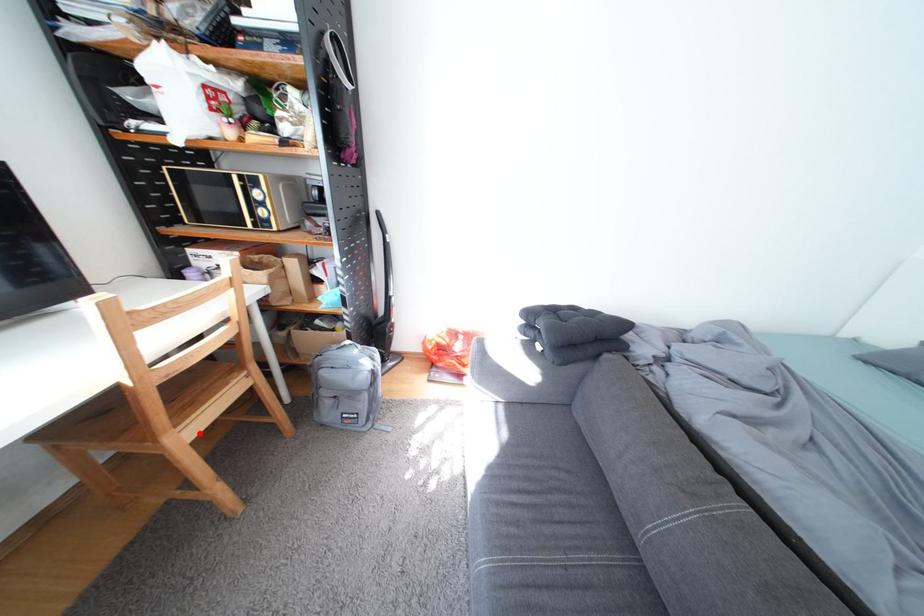
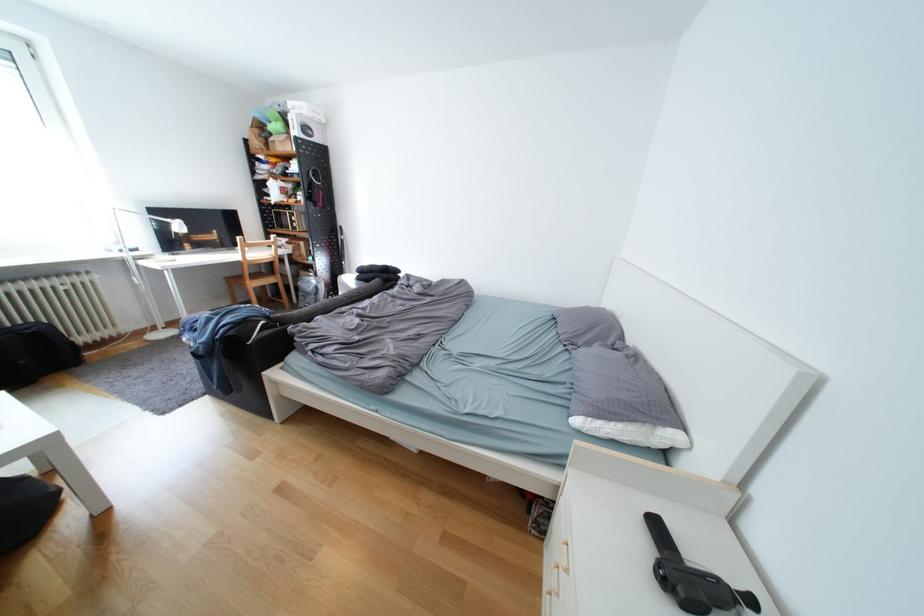
Question: I am providing you with two images of the same scene from different viewpoints. Image1 has a red point marked. In image2, the corresponding 3D location appears at what relative position? Reply with the corresponding letter.

Choices:
 (A) Closer
 (B) Farther

Answer: (A)